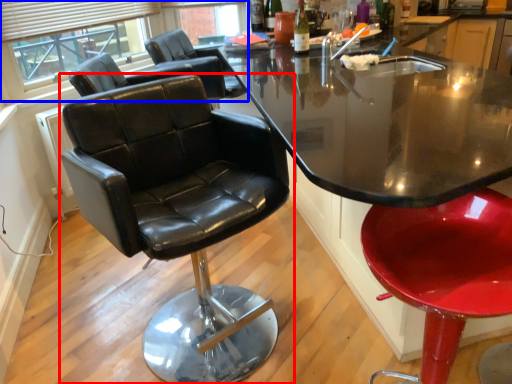
Question: Among these objects, which one is nearest to the camera, chair (highlighted by a red box) or bay window (highlighted by a blue box)?

Choices:
 (A) chair
 (B) bay window

Answer: (A)